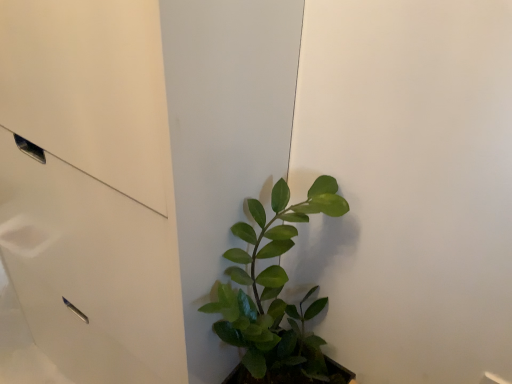
Question: Should I look upward or downward to see green matte plant at center?

Choices:
 (A) up
 (B) down

Answer: (B)